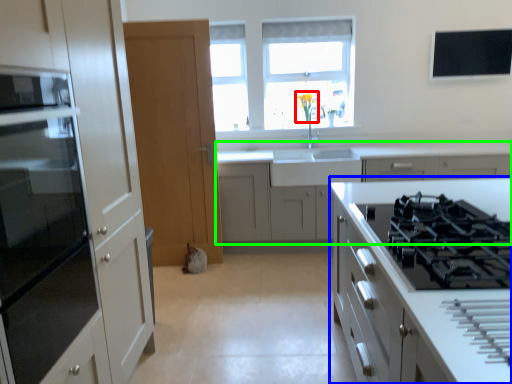
Question: Based on their relative distances, which object is farther from flower (highlighted by a red box)? Choose from cabinetry (highlighted by a blue box) and cabinetry (highlighted by a green box).

Choices:
 (A) cabinetry
 (B) cabinetry

Answer: (A)